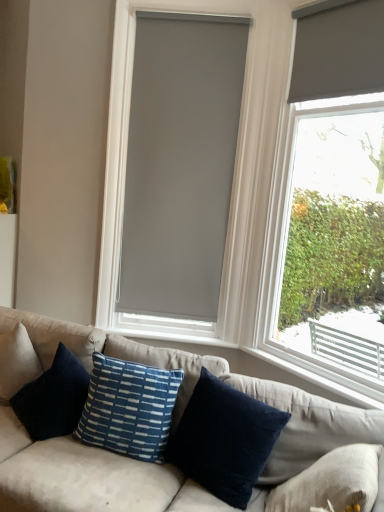
Question: Does navy blue cotton pillow at center, marked as the first pillow in a right-to-left arrangement, lie behind matte gray roller blind at upper right, which is the 2th window blind in back-to-front order?

Choices:
 (A) yes
 (B) no

Answer: (B)

Question: Considering the relative sizes of navy blue cotton pillow at center, marked as the first pillow in a right-to-left arrangement, and matte gray roller blind at upper right, arranged as the second window blind when viewed from the left, in the image provided, is navy blue cotton pillow at center, marked as the first pillow in a right-to-left arrangement, wider than matte gray roller blind at upper right, arranged as the second window blind when viewed from the left,?

Choices:
 (A) yes
 (B) no

Answer: (A)

Question: Is navy blue cotton pillow at center, the second pillow from the left, located outside matte gray roller blind at upper right, the 1th window blind viewed from the right?

Choices:
 (A) yes
 (B) no

Answer: (A)

Question: Is navy blue cotton pillow at center, marked as the first pillow in a right-to-left arrangement, oriented away from matte gray roller blind at upper right, arranged as the second window blind when viewed from the left?

Choices:
 (A) no
 (B) yes

Answer: (A)

Question: Can you confirm if navy blue cotton pillow at center, the second pillow from the left, is smaller than matte gray roller blind at upper right, the first window blind in the front-to-back sequence?

Choices:
 (A) no
 (B) yes

Answer: (A)

Question: Is matte gray roller blind at right taller or shorter than white plastic window sill at lower right?

Choices:
 (A) short
 (B) tall

Answer: (B)

Question: From a real-world perspective, is matte gray roller blind at right above or below white plastic window sill at lower right?

Choices:
 (A) above
 (B) below

Answer: (A)

Question: Considering the positions of matte gray roller blind at right and white plastic window sill at lower right in the image, is matte gray roller blind at right wider or thinner than white plastic window sill at lower right?

Choices:
 (A) wide
 (B) thin

Answer: (A)

Question: From the image's perspective, relative to white plastic window sill at lower right, is matte gray roller blind at right above or below?

Choices:
 (A) below
 (B) above

Answer: (B)

Question: Choose the correct answer: Is blue textured pillow at center, the second pillow when ordered from right to left, inside white plastic window sill at lower right or outside it?

Choices:
 (A) inside
 (B) outside

Answer: (B)

Question: From a real-world perspective, is blue textured pillow at center, the second pillow when ordered from right to left, above or below white plastic window sill at lower right?

Choices:
 (A) below
 (B) above

Answer: (B)

Question: From the image's perspective, is blue textured pillow at center, which is counted as the first pillow, starting from the left, located above or below white plastic window sill at lower right?

Choices:
 (A) below
 (B) above

Answer: (B)

Question: Is point (130, 372) closer or farther from the camera than point (326, 384)?

Choices:
 (A) farther
 (B) closer

Answer: (B)

Question: From a real-world perspective, is white plastic window sill at lower right physically located above or below navy blue cotton pillow at center, marked as the first pillow in a right-to-left arrangement?

Choices:
 (A) above
 (B) below

Answer: (A)

Question: Considering the positions of white plastic window sill at lower right and navy blue cotton pillow at center, the second pillow from the left, in the image, is white plastic window sill at lower right wider or thinner than navy blue cotton pillow at center, the second pillow from the left,?

Choices:
 (A) thin
 (B) wide

Answer: (A)